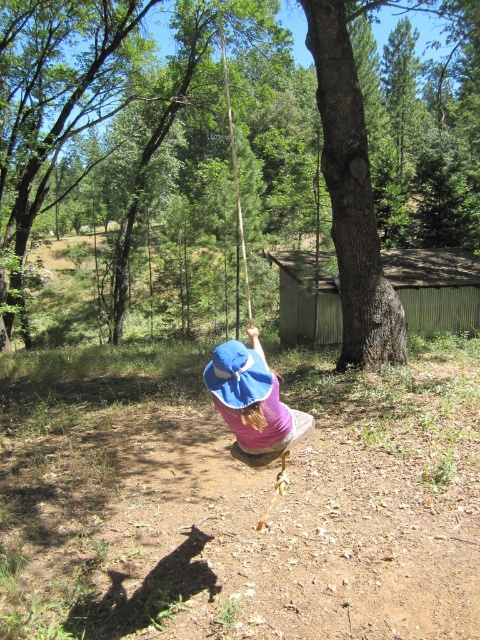
Who is taller, smooth bark tree at center or wooden swing at center?

wooden swing at center is taller.

Can you confirm if smooth bark tree at center is thinner than wooden swing at center?

Yes.

Where is `smooth bark tree at center`? The image size is (480, 640). smooth bark tree at center is located at coordinates (351, 192).

Does brown rough tree at center have a lesser width compared to wooden swing at center?

No.

Between brown rough tree at center and wooden swing at center, which one appears on the right side from the viewer's perspective?

From the viewer's perspective, wooden swing at center appears more on the right side.

The height and width of the screenshot is (640, 480). What are the coordinates of `brown rough tree at center` in the screenshot? It's located at (359, 148).

Locate an element on the screen. brown rough tree at center is located at coordinates (359, 148).

Is pink fabric sunhat at center to the left of wooden swing at center from the viewer's perspective?

Incorrect, pink fabric sunhat at center is not on the left side of wooden swing at center.

Locate an element on the screen. The width and height of the screenshot is (480, 640). pink fabric sunhat at center is located at coordinates (252, 403).